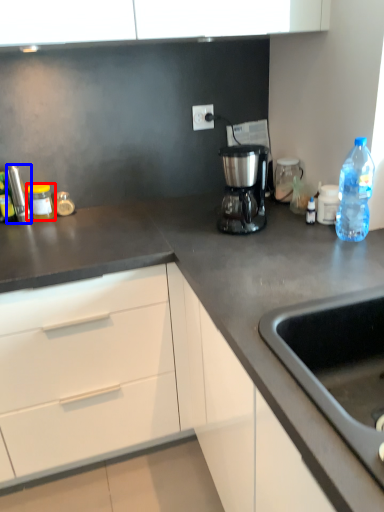
Question: Which object is closer to the camera taking this photo, kitchen appliance (highlighted by a red box) or appliance (highlighted by a blue box)?

Choices:
 (A) kitchen appliance
 (B) appliance

Answer: (B)